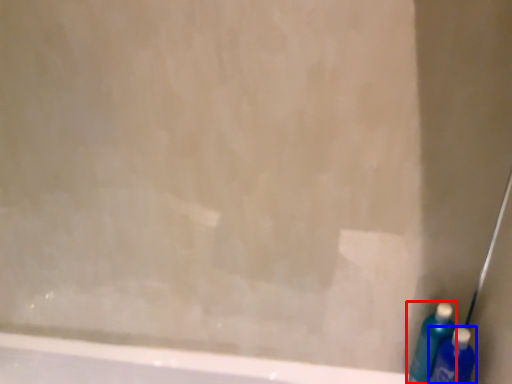
Question: Among these objects, which one is farthest to the camera, cleaning product (highlighted by a red box) or cleaning product (highlighted by a blue box)?

Choices:
 (A) cleaning product
 (B) cleaning product

Answer: (A)